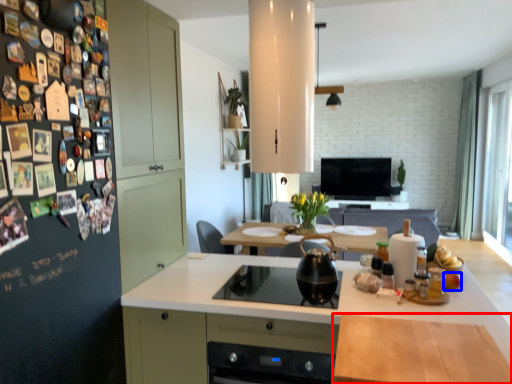
Question: Which of the following is the closest to the observer, countertop (highlighted by a red box) or food (highlighted by a blue box)?

Choices:
 (A) countertop
 (B) food

Answer: (A)